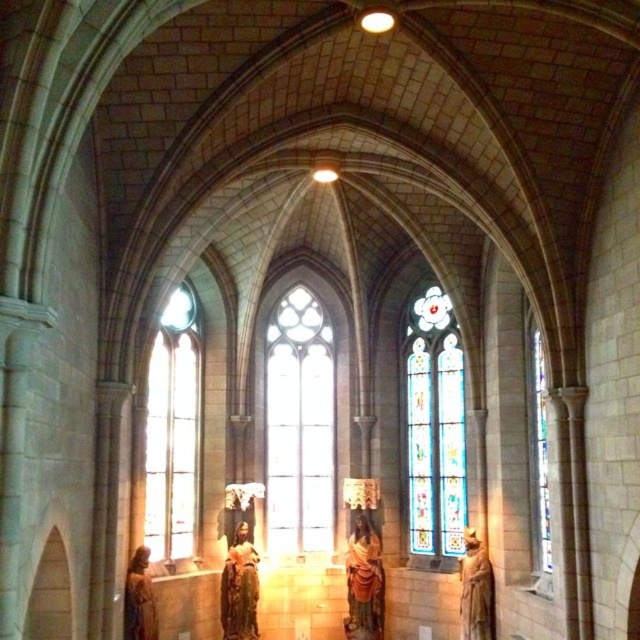
Question: Estimate the real-world distances between objects in this image. Which object is farther from the clear glass window at center?

Choices:
 (A) stained glass window at center
 (B) matte gold statue at lower left

Answer: (B)

Question: Based on their relative distances, which object is nearer to the stained glass window at center?

Choices:
 (A) golden statue at center
 (B) clear glass window at left
 (C) clear glass window at center

Answer: (C)

Question: Does clear glass window at left have a lesser width compared to matte gold statue at right?

Choices:
 (A) yes
 (B) no

Answer: (B)

Question: Does clear glass window at center appear on the left side of matte gold statue at right?

Choices:
 (A) yes
 (B) no

Answer: (A)

Question: Does clear glass window at center have a larger size compared to matte gold statue at lower left?

Choices:
 (A) yes
 (B) no

Answer: (A)

Question: Which object appears farthest from the camera in this image?

Choices:
 (A) matte gold statue at right
 (B) wooden statue at center

Answer: (B)